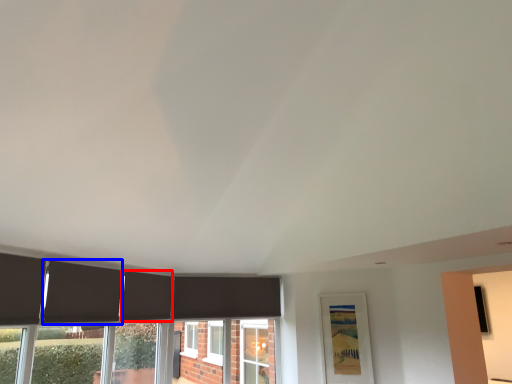
Question: Which object is further to the camera taking this photo, curtain (highlighted by a red box) or curtain (highlighted by a blue box)?

Choices:
 (A) curtain
 (B) curtain

Answer: (A)